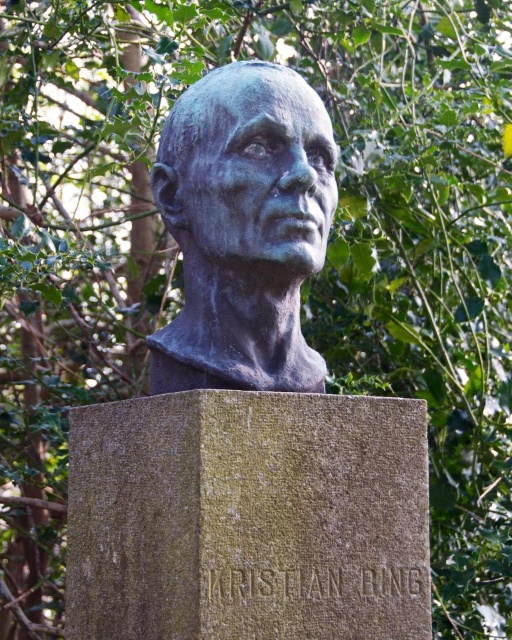
Question: Observing the image, what is the correct spatial positioning of green stone gravestone at center in reference to bronze bust at center?

Choices:
 (A) right
 (B) left

Answer: (B)

Question: Is green stone gravestone at center bigger than bronze bust at center?

Choices:
 (A) no
 (B) yes

Answer: (B)

Question: Which of the following is the farthest from the observer?

Choices:
 (A) (246, 225)
 (B) (356, 525)

Answer: (A)

Question: Which point appears closest to the camera in this image?

Choices:
 (A) (411, 486)
 (B) (280, 216)

Answer: (B)

Question: Is green stone gravestone at center thinner than bronze bust at center?

Choices:
 (A) yes
 (B) no

Answer: (B)